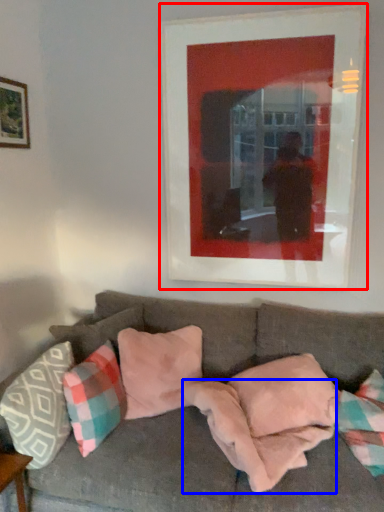
Question: Which of the following is the closest to the observer, picture frame (highlighted by a red box) or blanket (highlighted by a blue box)?

Choices:
 (A) picture frame
 (B) blanket

Answer: (B)